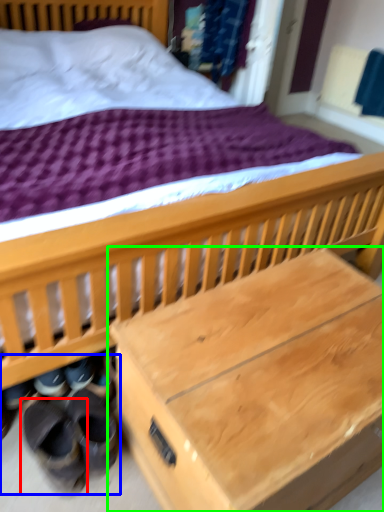
Question: Based on their relative distances, which object is nearer to footwear (highlighted by a red box)? Choose from shoe (highlighted by a blue box) and table (highlighted by a green box).

Choices:
 (A) shoe
 (B) table

Answer: (A)